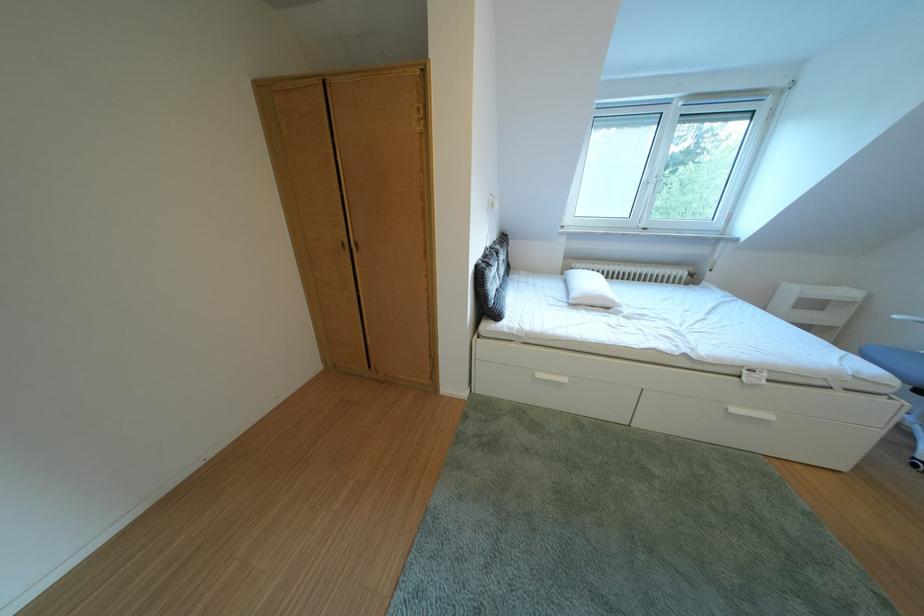
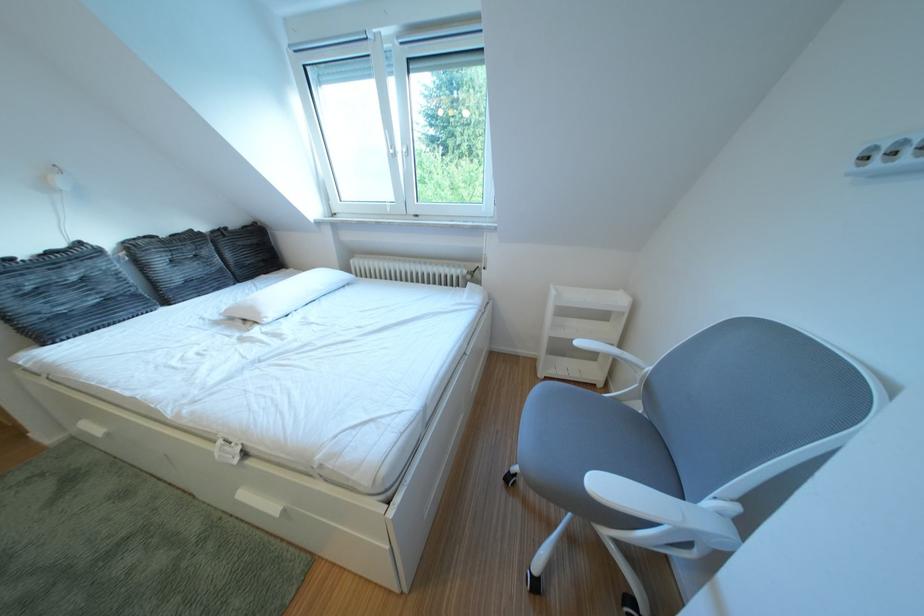
Question: The images are taken continuously from a first-person perspective. In which direction are you moving?

Choices:
 (A) Left
 (B) Right
 (C) Forward
 (D) Backward

Answer: (B)